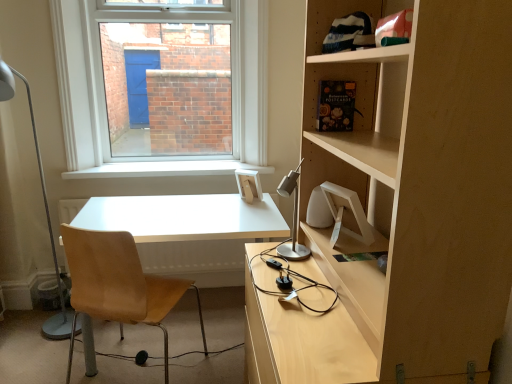
Where is `free spot above white smooth window sill at center (from a real-world perspective)`? The image size is (512, 384). free spot above white smooth window sill at center (from a real-world perspective) is located at coordinates (154, 166).